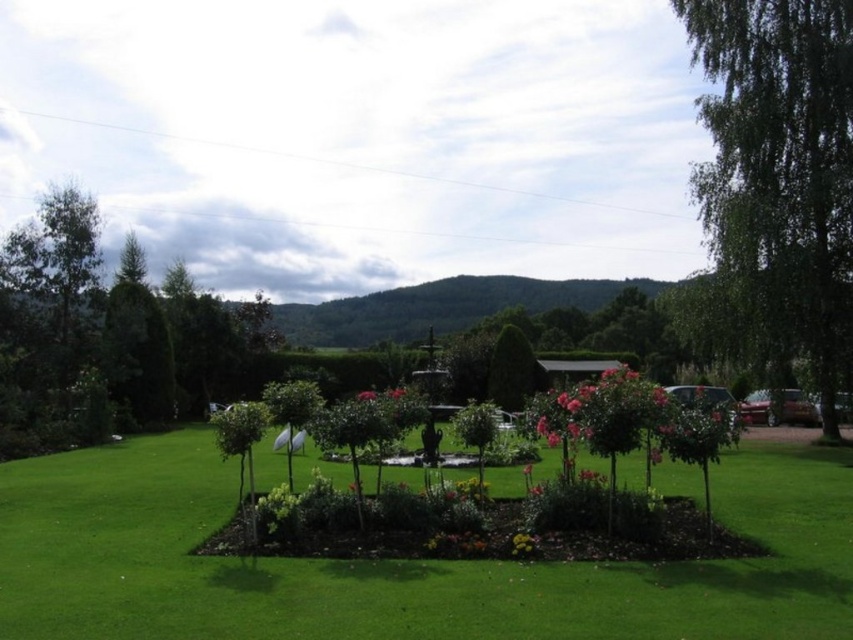
Question: Which object appears closest to the camera in this image?

Choices:
 (A) green leafy tree at right
 (B) green lawn at center
 (C) pink matte flower at center
 (D) glossy metallic car at right

Answer: (B)

Question: Considering the relative positions of metallic red car at right and glossy metallic car at right in the image provided, where is metallic red car at right located with respect to glossy metallic car at right?

Choices:
 (A) below
 (B) above

Answer: (B)

Question: Is green lawn at center positioned in front of metallic red car at right?

Choices:
 (A) yes
 (B) no

Answer: (A)

Question: Where is green leafy tree at left located in relation to metallic red car at right in the image?

Choices:
 (A) above
 (B) below

Answer: (A)

Question: Which object is farther from the camera taking this photo?

Choices:
 (A) metallic red car at right
 (B) green leafy tree at left
 (C) glossy metallic car at right

Answer: (B)

Question: Which point is farther to the camera?

Choices:
 (A) (686, 388)
 (B) (361, 392)
 (C) (720, 28)

Answer: (B)